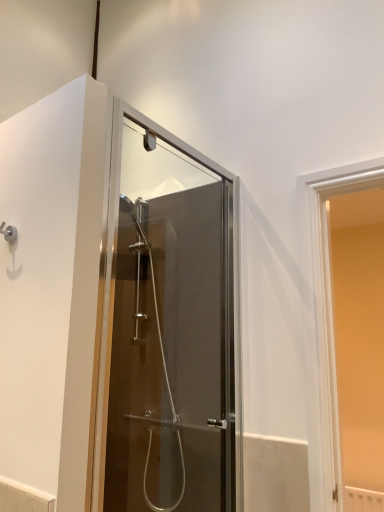
This screenshot has height=512, width=384. What do you see at coordinates (168, 329) in the screenshot? I see `clear glass shower door at center` at bounding box center [168, 329].

The width and height of the screenshot is (384, 512). Identify the location of clear glass shower door at center. (168, 329).

Locate an element on the screen. The width and height of the screenshot is (384, 512). clear glass shower door at center is located at coordinates (168, 329).